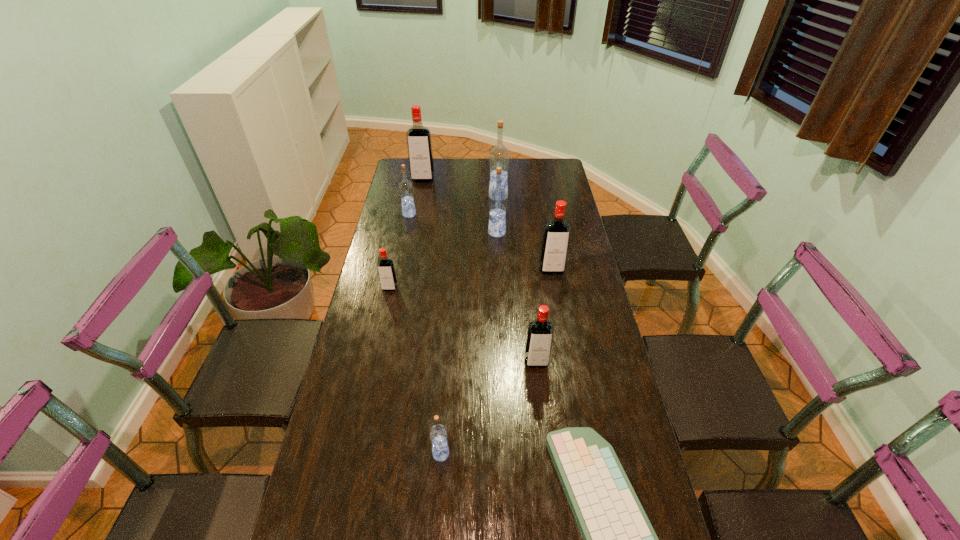
The height and width of the screenshot is (540, 960). I want to click on vacant region that satisfies the following two spatial constraints: 1. on the front and back of the biggest red vodka; 2. on the right side of the farthest blue vodka, so click(x=420, y=197).